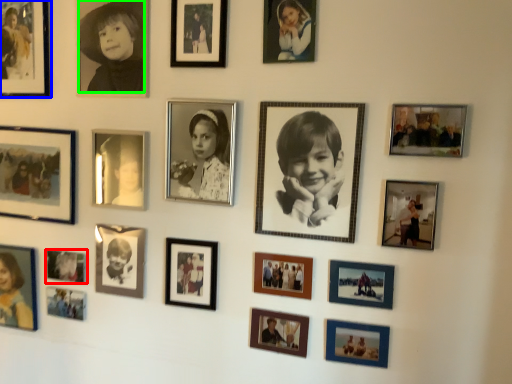
Question: Considering the real-world distances, which object is farthest from picture frame (highlighted by a red box)? picture frame (highlighted by a blue box) or person (highlighted by a green box)?

Choices:
 (A) picture frame
 (B) person

Answer: (B)